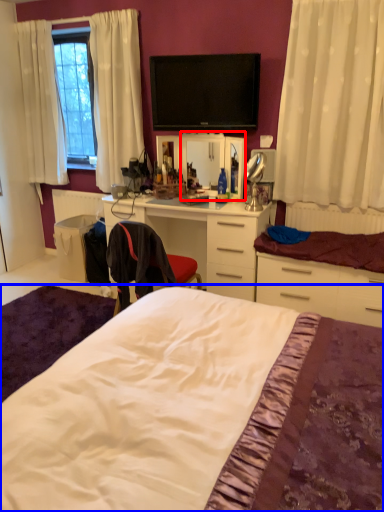
Question: Which point is further to the camera, mirror (highlighted by a red box) or bed (highlighted by a blue box)?

Choices:
 (A) mirror
 (B) bed

Answer: (A)